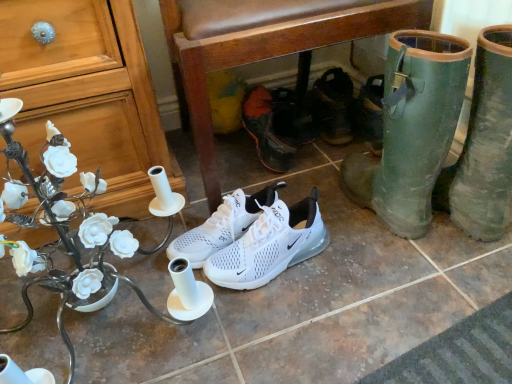
Where is `spots to the right of white mesh sneakers at center, arranged as the 3th footwear when viewed from the front`? spots to the right of white mesh sneakers at center, arranged as the 3th footwear when viewed from the front is located at coordinates (336, 245).